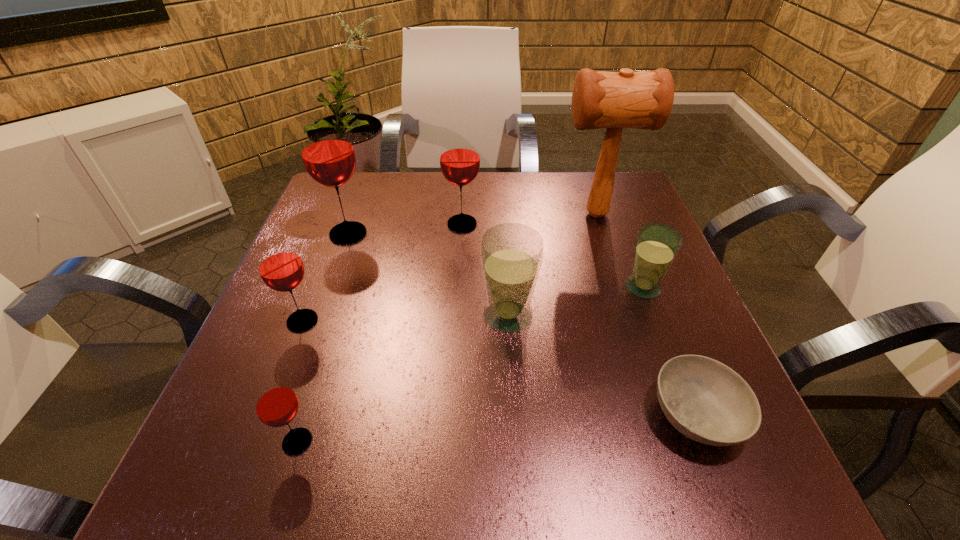
I want to click on the nearest red glass, so click(276, 404).

Identify the location of the shortest object. (705, 400).

This screenshot has width=960, height=540. In order to click on free space located on the strike surface of the mallet in this screenshot , I will do `click(443, 214)`.

Where is `vacant space situated 0.240m on the strike surface of the mallet`? vacant space situated 0.240m on the strike surface of the mallet is located at coordinates point(459,214).

The width and height of the screenshot is (960, 540). I want to click on free spot located on the strike surface of the mallet, so click(x=513, y=214).

Where is `vacant space positioned on the front of the biggest red glass`? The height and width of the screenshot is (540, 960). vacant space positioned on the front of the biggest red glass is located at coordinates (285, 409).

Identify the location of free spot located on the right of the third smallest red glass. (623, 224).

What are the coordinates of `free spot located 0.190m on the back of the second smallest red glass` in the screenshot? It's located at (332, 246).

Locate an element on the screen. The image size is (960, 540). free location located 0.220m on the right of the bigger blue glass is located at coordinates (651, 315).

Where is `vacant space located on the front of the rightmost glass`? Image resolution: width=960 pixels, height=540 pixels. vacant space located on the front of the rightmost glass is located at coordinates (688, 407).